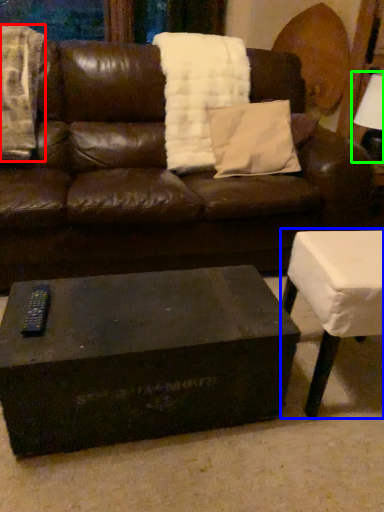
Question: Which object is the farthest from blanket (highlighted by a red box)? Choose among these: table (highlighted by a blue box) or table lamp (highlighted by a green box).

Choices:
 (A) table
 (B) table lamp

Answer: (B)